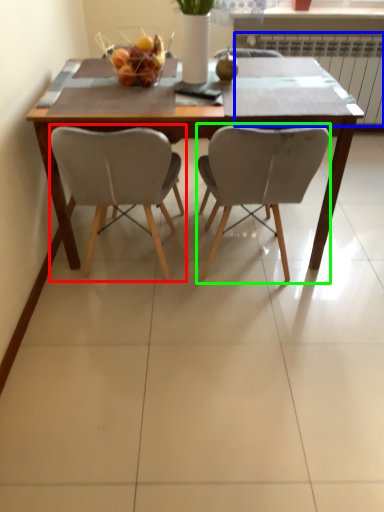
Question: Which is nearer to the chair (highlighted by a red box)? radiator (highlighted by a blue box) or chair (highlighted by a green box).

Choices:
 (A) radiator
 (B) chair

Answer: (B)